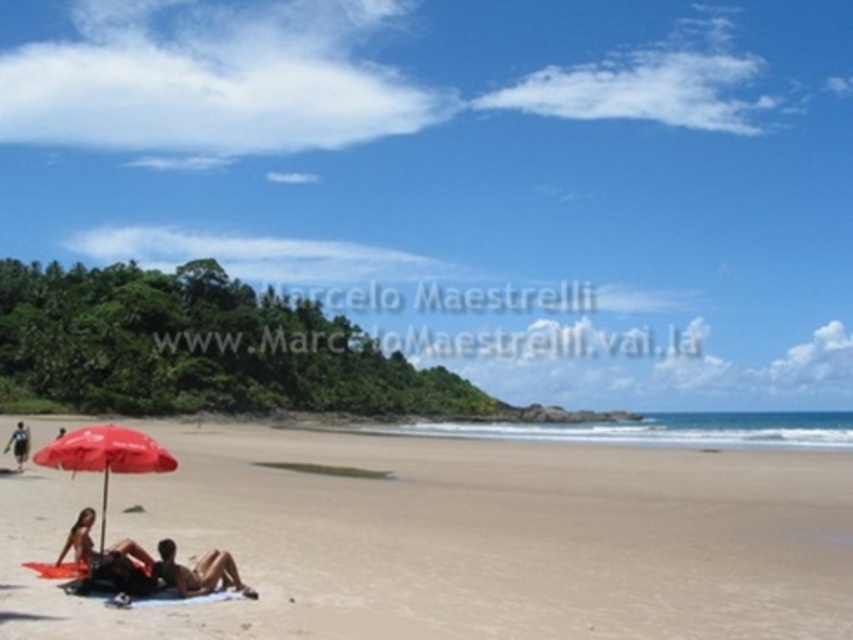
Between matte red umbrella at lower left and matte black bikini at lower left, which one has more height?

matte red umbrella at lower left is taller.

Between matte red umbrella at lower left and matte black bikini at lower left, which one appears on the right side from the viewer's perspective?

matte black bikini at lower left

Is point (68, 451) positioned before point (202, 564)?

That is False.

Where is `matte red umbrella at lower left`? matte red umbrella at lower left is located at coordinates (105, 456).

Does point (105, 461) come behind point (4, 451)?

No.

Does matte red umbrella at lower left appear over dark blue fabric at lower left?

Yes.

Is point (73, 460) positioned in front of point (4, 449)?

Yes, it is.

Locate an element on the screen. The width and height of the screenshot is (853, 640). matte red umbrella at lower left is located at coordinates (105, 456).

Does beige sand at lower left appear on the right side of dark blue fabric at lower left?

Indeed, beige sand at lower left is positioned on the right side of dark blue fabric at lower left.

Who is positioned more to the left, beige sand at lower left or dark blue fabric at lower left?

Positioned to the left is dark blue fabric at lower left.

Describe the element at coordinates (457, 538) in the screenshot. I see `beige sand at lower left` at that location.

Where is `beige sand at lower left`? This screenshot has width=853, height=640. beige sand at lower left is located at coordinates (457, 538).